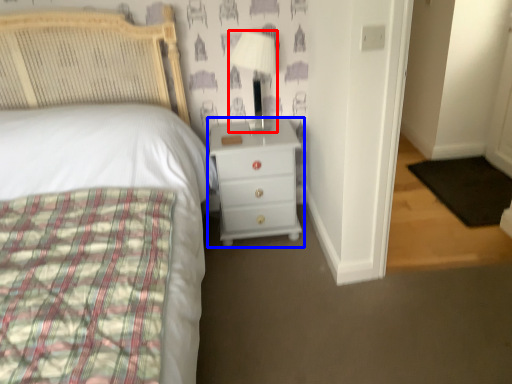
Question: Which point is further to the camera, lamp (highlighted by a red box) or chest of drawers (highlighted by a blue box)?

Choices:
 (A) lamp
 (B) chest of drawers

Answer: (B)